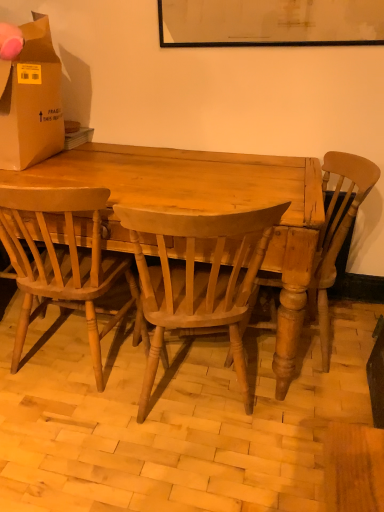
The height and width of the screenshot is (512, 384). What do you see at coordinates (61, 261) in the screenshot? I see `light brown wood chair at center, placed as the third chair when sorted from right to left` at bounding box center [61, 261].

Measure the distance between light brown wood desk at center and camera.

light brown wood desk at center is 3.93 feet away from camera.

What do you see at coordinates (31, 100) in the screenshot? Image resolution: width=384 pixels, height=512 pixels. I see `brown cardboard box at upper left` at bounding box center [31, 100].

This screenshot has width=384, height=512. Describe the element at coordinates (336, 232) in the screenshot. I see `light brown wood chair at center, acting as the 1th chair starting from the right` at that location.

The width and height of the screenshot is (384, 512). I want to click on light brown wood chair at center, which is the first chair in left-to-right order, so click(x=61, y=261).

Can you confirm if light brown wood desk at center is taller than light brown wood chair at center, which is the second chair from right to left?

Incorrect, the height of light brown wood desk at center is not larger of that of light brown wood chair at center, which is the second chair from right to left.

Does light brown wood desk at center appear on the left side of light brown wood chair at center, which is the second chair from right to left?

Yes, light brown wood desk at center is to the left of light brown wood chair at center, which is the second chair from right to left.

Is light brown wood desk at center closer to the viewer compared to light brown wood chair at center, the second chair positioned from the left?

No, light brown wood desk at center is further to the viewer.

In the scene shown: Considering the relative sizes of light brown wood desk at center and light brown wood chair at center, the second chair positioned from the left, in the image provided, is light brown wood desk at center thinner than light brown wood chair at center, the second chair positioned from the left,?

No, light brown wood desk at center is not thinner than light brown wood chair at center, the second chair positioned from the left.

Is brown cardboard box at upper left far from light brown wood chair at center, the second chair positioned from the left?

Actually, brown cardboard box at upper left and light brown wood chair at center, the second chair positioned from the left, are a little close together.

Is brown cardboard box at upper left situated inside light brown wood chair at center, which is the second chair from right to left, or outside?

brown cardboard box at upper left is not enclosed by light brown wood chair at center, which is the second chair from right to left.

Considering the positions of points (329, 165) and (150, 170), is point (329, 165) closer to camera compared to point (150, 170)?

That is False.

What are the coordinates of `desk below the light brown wood chair at center, which ranks as the 3th chair in left-to-right order (from a real-world perspective)` in the screenshot? It's located at (207, 208).

Would you say light brown wood desk at center is part of light brown wood chair at center, acting as the 1th chair starting from the right,'s contents?

Definitely not — light brown wood desk at center is not inside light brown wood chair at center, acting as the 1th chair starting from the right.

How many degrees apart are the facing directions of light brown wood chair at center, acting as the 1th chair starting from the right, and light brown wood desk at center?

They differ by 84.2 degrees in their facing directions.

In the image, is light brown wood chair at center, which is the first chair in left-to-right order, positioned in front of or behind light brown wood chair at center, the second chair positioned from the left?

light brown wood chair at center, which is the first chair in left-to-right order, is positioned farther from the viewer than light brown wood chair at center, the second chair positioned from the left.

From a real-world perspective, which object stands above the other?

light brown wood chair at center, placed as the third chair when sorted from right to left, is physically above.

Is light brown wood chair at center, placed as the third chair when sorted from right to left, positioned beyond the bounds of light brown wood chair at center, the second chair positioned from the left?

light brown wood chair at center, placed as the third chair when sorted from right to left, is positioned outside light brown wood chair at center, the second chair positioned from the left.

Is light brown wood chair at center, placed as the third chair when sorted from right to left, placed right next to light brown wood chair at center, the second chair positioned from the left?

No, light brown wood chair at center, placed as the third chair when sorted from right to left, is not touching light brown wood chair at center, the second chair positioned from the left.

Between light brown wood chair at center, acting as the 1th chair starting from the right, and light brown wood chair at center, which is the second chair from right to left, which one has larger width?

light brown wood chair at center, which is the second chair from right to left.

How many degrees apart are the facing directions of light brown wood chair at center, which ranks as the 3th chair in left-to-right order, and light brown wood chair at center, the second chair positioned from the left?

The facing directions of light brown wood chair at center, which ranks as the 3th chair in left-to-right order, and light brown wood chair at center, the second chair positioned from the left, are 73.2 degrees apart.

Considering the sizes of light brown wood chair at center, which ranks as the 3th chair in left-to-right order, and light brown wood chair at center, the second chair positioned from the left, in the image, is light brown wood chair at center, which ranks as the 3th chair in left-to-right order, bigger or smaller than light brown wood chair at center, the second chair positioned from the left,?

Clearly, light brown wood chair at center, which ranks as the 3th chair in left-to-right order, is larger in size than light brown wood chair at center, the second chair positioned from the left.

Is point (349, 228) farther from camera compared to point (164, 329)?

No, it is not.

In terms of width, does light brown wood chair at center, which is the first chair in left-to-right order, look wider or thinner when compared to light brown wood chair at center, acting as the 1th chair starting from the right?

In the image, light brown wood chair at center, which is the first chair in left-to-right order, appears to be wider than light brown wood chair at center, acting as the 1th chair starting from the right.

Locate an element on the screen. the 2nd chair to the right of the light brown wood chair at center, which is the first chair in left-to-right order, counting from the anchor's position is located at coordinates (336, 232).

Does light brown wood chair at center, placed as the third chair when sorted from right to left, appear on the left side of light brown wood chair at center, acting as the 1th chair starting from the right?

Yes, light brown wood chair at center, placed as the third chair when sorted from right to left, is to the left of light brown wood chair at center, acting as the 1th chair starting from the right.

How many degrees apart are the facing directions of light brown wood chair at center, placed as the third chair when sorted from right to left, and light brown wood chair at center, which ranks as the 3th chair in left-to-right order?

95.1 degrees.

Is brown cardboard box at upper left to the left or to the right of light brown wood chair at center, acting as the 1th chair starting from the right, in the image?

brown cardboard box at upper left is to the left of light brown wood chair at center, acting as the 1th chair starting from the right.

Are brown cardboard box at upper left and light brown wood chair at center, acting as the 1th chair starting from the right, beside each other?

No, brown cardboard box at upper left is not making contact with light brown wood chair at center, acting as the 1th chair starting from the right.

Which object is further away from the camera taking this photo, brown cardboard box at upper left or light brown wood chair at center, acting as the 1th chair starting from the right?

Positioned behind is brown cardboard box at upper left.

Between brown cardboard box at upper left and light brown wood chair at center, acting as the 1th chair starting from the right, which one has less height?

brown cardboard box at upper left.

This screenshot has height=512, width=384. What are the coordinates of `desk above the light brown wood chair at center, which is the second chair from right to left (from the image's perspective)` in the screenshot? It's located at (207, 208).

What are the coordinates of `box on the left of light brown wood chair at center, the second chair positioned from the left` in the screenshot? It's located at (31, 100).

From the image, which object appears to be nearer to light brown wood chair at center, which ranks as the 3th chair in left-to-right order, light brown wood chair at center, which is the first chair in left-to-right order, or brown cardboard box at upper left?

The object closer to light brown wood chair at center, which ranks as the 3th chair in left-to-right order, is light brown wood chair at center, which is the first chair in left-to-right order.

Based on their spatial positions, is brown cardboard box at upper left or light brown wood chair at center, placed as the third chair when sorted from right to left, further from light brown wood chair at center, which is the second chair from right to left?

brown cardboard box at upper left.

Estimate the real-world distances between objects in this image. Which object is further from light brown wood chair at center, which is the second chair from right to left, light brown wood chair at center, which is the first chair in left-to-right order, or light brown wood desk at center?

Based on the image, light brown wood chair at center, which is the first chair in left-to-right order, appears to be further to light brown wood chair at center, which is the second chair from right to left.

Considering their positions, is light brown wood desk at center positioned further to light brown wood chair at center, the second chair positioned from the left, than light brown wood chair at center, acting as the 1th chair starting from the right?

The object further to light brown wood chair at center, the second chair positioned from the left, is light brown wood chair at center, acting as the 1th chair starting from the right.

When comparing their distances from light brown wood desk at center, does light brown wood chair at center, which is the first chair in left-to-right order, or light brown wood chair at center, which ranks as the 3th chair in left-to-right order, seem further?

light brown wood chair at center, which ranks as the 3th chair in left-to-right order.

Looking at the image, which one is located closer to light brown wood desk at center, light brown wood chair at center, acting as the 1th chair starting from the right, or brown cardboard box at upper left?

light brown wood chair at center, acting as the 1th chair starting from the right.

Considering their positions, is light brown wood chair at center, placed as the third chair when sorted from right to left, positioned further to light brown wood desk at center than light brown wood chair at center, which is the second chair from right to left?

light brown wood chair at center, placed as the third chair when sorted from right to left, is positioned further to the anchor light brown wood desk at center.

Considering their positions, is light brown wood desk at center positioned further to brown cardboard box at upper left than light brown wood chair at center, which ranks as the 3th chair in left-to-right order?

light brown wood chair at center, which ranks as the 3th chair in left-to-right order.

This screenshot has width=384, height=512. Find the location of `desk between brown cardboard box at upper left and light brown wood chair at center, which is the first chair in left-to-right order, from top to bottom`. desk between brown cardboard box at upper left and light brown wood chair at center, which is the first chair in left-to-right order, from top to bottom is located at coordinates (207, 208).

Where is `chair situated between light brown wood desk at center and light brown wood chair at center, which ranks as the 3th chair in left-to-right order, from left to right`? chair situated between light brown wood desk at center and light brown wood chair at center, which ranks as the 3th chair in left-to-right order, from left to right is located at coordinates (199, 277).

Find the location of a particular element. The image size is (384, 512). desk located between light brown wood chair at center, which is the first chair in left-to-right order, and light brown wood chair at center, which is the second chair from right to left, in the left-right direction is located at coordinates (207, 208).

Where is `desk between brown cardboard box at upper left and light brown wood chair at center, which ranks as the 3th chair in left-to-right order, in the horizontal direction`? The height and width of the screenshot is (512, 384). desk between brown cardboard box at upper left and light brown wood chair at center, which ranks as the 3th chair in left-to-right order, in the horizontal direction is located at coordinates (207, 208).